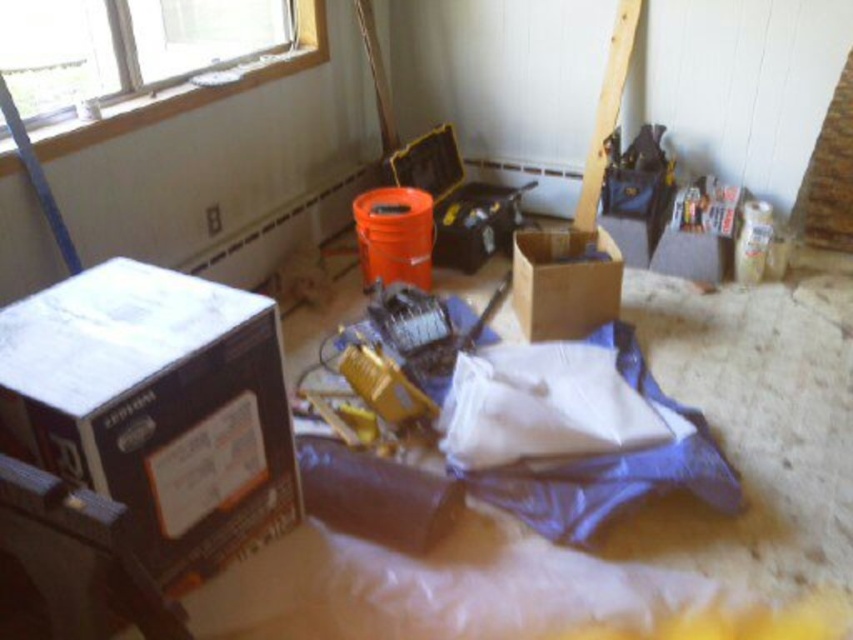
Question: Among these objects, which one is nearest to the camera?

Choices:
 (A) brown cardboard box at center
 (B) white painted wood window at upper left

Answer: (B)

Question: Which object is closer to the camera taking this photo?

Choices:
 (A) brown cardboard box at center
 (B) brown cardboard box at left
 (C) white painted wood window at upper left

Answer: (B)

Question: Is brown cardboard box at left in front of white painted wood window at upper left?

Choices:
 (A) no
 (B) yes

Answer: (B)

Question: Does brown cardboard box at left lie in front of white painted wood window at upper left?

Choices:
 (A) no
 (B) yes

Answer: (B)

Question: Does brown cardboard box at left appear under white painted wood window at upper left?

Choices:
 (A) yes
 (B) no

Answer: (A)

Question: Estimate the real-world distances between objects in this image. Which object is farther from the brown cardboard box at center?

Choices:
 (A) brown cardboard box at left
 (B) white painted wood window at upper left

Answer: (B)